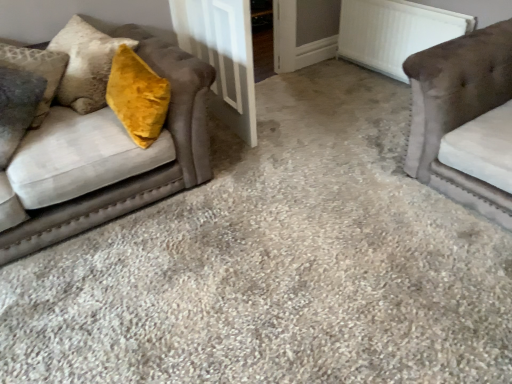
Question: From the image's perspective, is white textured radiator at upper right below velvet brown couch at left, placed as the first studio couch when sorted from left to right?

Choices:
 (A) yes
 (B) no

Answer: (B)

Question: Is white textured radiator at upper right positioned before velvet brown couch at left, which is the 2th studio couch in right-to-left order?

Choices:
 (A) no
 (B) yes

Answer: (A)

Question: Does white textured radiator at upper right have a greater width compared to velvet brown couch at left, which is the 2th studio couch in right-to-left order?

Choices:
 (A) yes
 (B) no

Answer: (B)

Question: Is white textured radiator at upper right outside velvet brown couch at left, which is the 2th studio couch in right-to-left order?

Choices:
 (A) no
 (B) yes

Answer: (B)

Question: Is white textured radiator at upper right positioned with its back to velvet brown couch at left, which is the 2th studio couch in right-to-left order?

Choices:
 (A) no
 (B) yes

Answer: (A)

Question: Visually, is white wood door at center positioned to the left or to the right of white textured radiator at upper right?

Choices:
 (A) right
 (B) left

Answer: (B)

Question: Is white wood door at center situated inside white textured radiator at upper right or outside?

Choices:
 (A) outside
 (B) inside

Answer: (A)

Question: From the image's perspective, relative to white textured radiator at upper right, is white wood door at center above or below?

Choices:
 (A) above
 (B) below

Answer: (B)

Question: Considering the positions of white wood door at center and white textured radiator at upper right in the image, is white wood door at center taller or shorter than white textured radiator at upper right?

Choices:
 (A) short
 (B) tall

Answer: (B)

Question: Considering the positions of velvet brown couch at left, which is the 2th studio couch in right-to-left order, and suede-like beige couch at right, the second studio couch from the left, in the image, is velvet brown couch at left, which is the 2th studio couch in right-to-left order, wider or thinner than suede-like beige couch at right, the second studio couch from the left,?

Choices:
 (A) wide
 (B) thin

Answer: (B)

Question: Looking at the image, does velvet brown couch at left, which is the 2th studio couch in right-to-left order, seem bigger or smaller compared to suede-like beige couch at right, the second studio couch from the left?

Choices:
 (A) big
 (B) small

Answer: (A)

Question: From a real-world perspective, is velvet brown couch at left, which is the 2th studio couch in right-to-left order, physically located above or below suede-like beige couch at right, which is counted as the 1th studio couch, starting from the right?

Choices:
 (A) below
 (B) above

Answer: (A)

Question: Is velvet brown couch at left, which is the 2th studio couch in right-to-left order, in front of or behind suede-like beige couch at right, which is counted as the 1th studio couch, starting from the right, in the image?

Choices:
 (A) front
 (B) behind

Answer: (B)

Question: In the image, is white textured radiator at upper right on the left side or the right side of white wood door at center?

Choices:
 (A) right
 (B) left

Answer: (A)

Question: Is white textured radiator at upper right inside the boundaries of white wood door at center, or outside?

Choices:
 (A) inside
 (B) outside

Answer: (B)